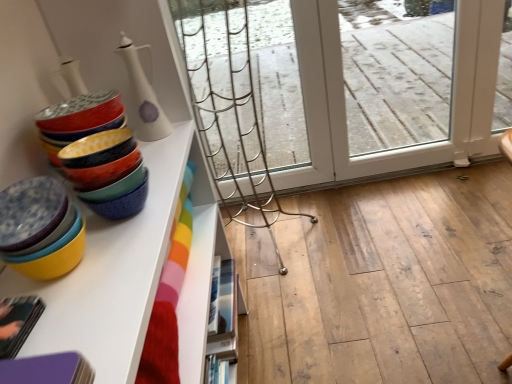
The height and width of the screenshot is (384, 512). Describe the element at coordinates (143, 96) in the screenshot. I see `white glossy vase at upper left, the 2th tableware when ordered from bottom to top` at that location.

The height and width of the screenshot is (384, 512). What do you see at coordinates (39, 228) in the screenshot? I see `matte ceramic bowls at left` at bounding box center [39, 228].

Locate an element on the screen. white glossy bookshelf at lower center is located at coordinates (226, 303).

Where is `white glossy vase at upper left, acting as the second tableware starting from the front`? This screenshot has height=384, width=512. white glossy vase at upper left, acting as the second tableware starting from the front is located at coordinates (143, 96).

Between white glossy vase at upper left, placed as the first tableware when sorted from back to front, and matte ceramic bowls at left, which one has larger width?

Wider between the two is matte ceramic bowls at left.

Is white glossy vase at upper left, which ranks as the first tableware in top-to-bottom order, completely or partially outside of matte ceramic bowls at left?

white glossy vase at upper left, which ranks as the first tableware in top-to-bottom order, is positioned outside matte ceramic bowls at left.

Which is more to the right, white glossy vase at upper left, which ranks as the first tableware in top-to-bottom order, or matte ceramic bowls at left?

From the viewer's perspective, white glossy vase at upper left, which ranks as the first tableware in top-to-bottom order, appears more on the right side.

From the image's perspective, starting from the white glossy bookshelf at lower center, which tableware is the 1st one above? Please provide its 2D coordinates.

[(82, 127)]

Does point (233, 337) appear closer or farther from the camera than point (137, 203)?

Clearly, point (233, 337) is more distant from the camera than point (137, 203).

Can you tell me how much white glossy bookshelf at lower center and matte ceramic bowls at left, which appears as the 2th tableware when viewed from the top, differ in facing direction?

3.7e-05 degrees.

Could matte ceramic bowls at left, positioned as the second tableware in back-to-front order, be considered to be inside white glossy bookshelf at lower center?

No.

Is point (57, 218) behind point (105, 121)?

No, (57, 218) is in front of (105, 121).

In order to click on table below the matte ceramic bowls at left, positioned as the second tableware in back-to-front order (from a real-world perspective) in this screenshot , I will do `click(39, 228)`.

Between matte ceramic bowls at left and matte ceramic bowls at left, which is the 1th tableware in front-to-back order, which one has more height?

matte ceramic bowls at left, which is the 1th tableware in front-to-back order, is taller.

Can you tell me how much matte ceramic bowls at left and matte ceramic bowls at left, which appears as the 2th tableware when viewed from the top, differ in facing direction?

4.11e-05 degrees separate the facing orientations of matte ceramic bowls at left and matte ceramic bowls at left, which appears as the 2th tableware when viewed from the top.

Considering the sizes of objects matte ceramic bowls at left, positioned as the second tableware in back-to-front order, and white glossy bookshelf at lower center in the image provided, who is bigger, matte ceramic bowls at left, positioned as the second tableware in back-to-front order, or white glossy bookshelf at lower center?

white glossy bookshelf at lower center is bigger.

From the image's perspective, is matte ceramic bowls at left, which is the 1th tableware in front-to-back order, above or below white glossy bookshelf at lower center?

matte ceramic bowls at left, which is the 1th tableware in front-to-back order, is above white glossy bookshelf at lower center.

Is the depth of matte ceramic bowls at left, which is the 1th tableware in front-to-back order, less than that of white glossy bookshelf at lower center?

Yes, matte ceramic bowls at left, which is the 1th tableware in front-to-back order, is closer to the camera.

Is white glossy vase at upper left, which ranks as the first tableware in top-to-bottom order, far from matte ceramic bowls at left, positioned as the 1th tableware in bottom-to-top order?

No.

Can you confirm if white glossy vase at upper left, the 2th tableware when ordered from bottom to top, is taller than matte ceramic bowls at left, positioned as the second tableware in back-to-front order?

Indeed, white glossy vase at upper left, the 2th tableware when ordered from bottom to top, has a greater height compared to matte ceramic bowls at left, positioned as the second tableware in back-to-front order.

How many degrees apart are the facing directions of white glossy vase at upper left, which ranks as the first tableware in top-to-bottom order, and matte ceramic bowls at left, which appears as the 2th tableware when viewed from the top?

white glossy vase at upper left, which ranks as the first tableware in top-to-bottom order, and matte ceramic bowls at left, which appears as the 2th tableware when viewed from the top, are facing 1.28 degrees away from each other.

Does white glossy vase at upper left, acting as the second tableware starting from the front, appear on the right side of matte ceramic bowls at left, which is the 1th tableware in front-to-back order?

Incorrect, white glossy vase at upper left, acting as the second tableware starting from the front, is not on the right side of matte ceramic bowls at left, which is the 1th tableware in front-to-back order.

Is white glossy bookshelf at lower center in front of or behind matte ceramic bowls at left in the image?

white glossy bookshelf at lower center is positioned farther from the viewer than matte ceramic bowls at left.

Is white glossy bookshelf at lower center wider than matte ceramic bowls at left?

No.

Where is `shelf behind the matte ceramic bowls at left`? The width and height of the screenshot is (512, 384). shelf behind the matte ceramic bowls at left is located at coordinates (226, 303).

Does white glossy bookshelf at lower center have a smaller size compared to matte ceramic bowls at left?

No, white glossy bookshelf at lower center is not smaller than matte ceramic bowls at left.

Is the depth of matte ceramic bowls at left, which appears as the 2th tableware when viewed from the top, less than that of white glossy vase at upper left, the 2th tableware when ordered from bottom to top?

Yes, matte ceramic bowls at left, which appears as the 2th tableware when viewed from the top, is in front of white glossy vase at upper left, the 2th tableware when ordered from bottom to top.

From the image's perspective, is matte ceramic bowls at left, which is the 1th tableware in front-to-back order, beneath white glossy vase at upper left, placed as the first tableware when sorted from back to front?

Yes.

Could you tell me if matte ceramic bowls at left, which is the 1th tableware in front-to-back order, is turned towards white glossy vase at upper left, which ranks as the first tableware in top-to-bottom order?

No, matte ceramic bowls at left, which is the 1th tableware in front-to-back order, is not turned towards white glossy vase at upper left, which ranks as the first tableware in top-to-bottom order.

This screenshot has height=384, width=512. I want to click on table on the left of the white glossy vase at upper left, placed as the first tableware when sorted from back to front, so click(39, 228).

Where is `shelf on the right of the matte ceramic bowls at left, which is the 1th tableware in front-to-back order`? This screenshot has width=512, height=384. shelf on the right of the matte ceramic bowls at left, which is the 1th tableware in front-to-back order is located at coordinates (226, 303).

From the image, which object appears to be farther from white glossy bookshelf at lower center, white glossy vase at upper left, acting as the second tableware starting from the front, or matte ceramic bowls at left?

Among the two, matte ceramic bowls at left is located further to white glossy bookshelf at lower center.

Based on their spatial positions, is white glossy vase at upper left, acting as the second tableware starting from the front, or white glossy bookshelf at lower center closer to matte ceramic bowls at left?

Among the two, white glossy vase at upper left, acting as the second tableware starting from the front, is located nearer to matte ceramic bowls at left.

Which object lies nearer to the anchor point white glossy vase at upper left, which ranks as the first tableware in top-to-bottom order, matte ceramic bowls at left or white glossy bookshelf at lower center?

The object closer to white glossy vase at upper left, which ranks as the first tableware in top-to-bottom order, is matte ceramic bowls at left.

From the image, which object appears to be farther from matte ceramic bowls at left, white glossy vase at upper left, placed as the first tableware when sorted from back to front, or matte ceramic bowls at left, which is the 1th tableware in front-to-back order?

Among the two, white glossy vase at upper left, placed as the first tableware when sorted from back to front, is located further to matte ceramic bowls at left.

When comparing their distances from matte ceramic bowls at left, positioned as the second tableware in back-to-front order, does white glossy bookshelf at lower center or white glossy vase at upper left, which ranks as the first tableware in top-to-bottom order, seem further?

white glossy bookshelf at lower center.

From the picture: When comparing their distances from white glossy bookshelf at lower center, does matte ceramic bowls at left or matte ceramic bowls at left, positioned as the second tableware in back-to-front order, seem closer?

matte ceramic bowls at left, positioned as the second tableware in back-to-front order, is closer to white glossy bookshelf at lower center.

Looking at the image, which one is located further to white glossy vase at upper left, acting as the second tableware starting from the front, matte ceramic bowls at left, which appears as the 2th tableware when viewed from the top, or matte ceramic bowls at left?

Based on the image, matte ceramic bowls at left appears to be further to white glossy vase at upper left, acting as the second tableware starting from the front.

Looking at the image, which one is located closer to matte ceramic bowls at left, white glossy bookshelf at lower center or matte ceramic bowls at left, positioned as the 1th tableware in bottom-to-top order?

Based on the image, matte ceramic bowls at left, positioned as the 1th tableware in bottom-to-top order, appears to be nearer to matte ceramic bowls at left.

The width and height of the screenshot is (512, 384). I want to click on table between white glossy vase at upper left, placed as the first tableware when sorted from back to front, and white glossy bookshelf at lower center in the up-down direction, so click(39, 228).

Identify the location of tableware between white glossy vase at upper left, placed as the first tableware when sorted from back to front, and white glossy bookshelf at lower center vertically. This screenshot has height=384, width=512. (82, 127).

Find the location of a particular element. tableware between matte ceramic bowls at left and white glossy vase at upper left, acting as the second tableware starting from the front, along the z-axis is located at coordinates (82, 127).